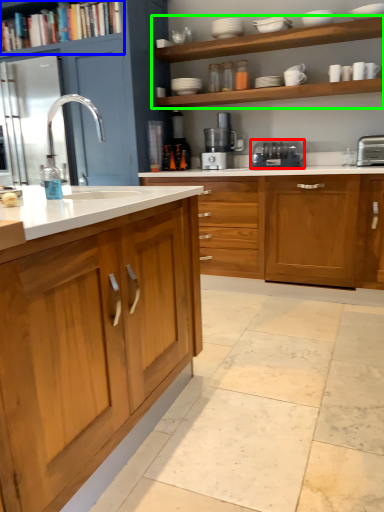
Question: Which object is the farthest from home appliance (highlighted by a red box)? Choose among these: shelf (highlighted by a blue box) or shelf (highlighted by a green box).

Choices:
 (A) shelf
 (B) shelf

Answer: (A)